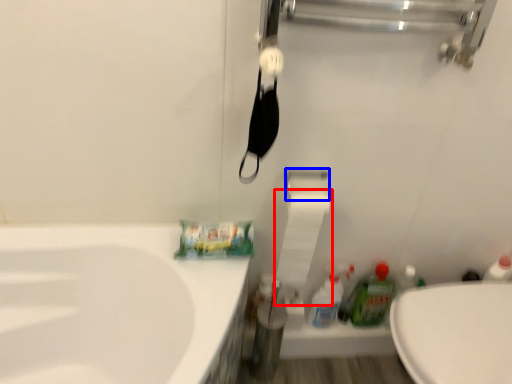
Question: Which object appears farthest to the camera in this image, toilet paper (highlighted by a red box) or towel bar (highlighted by a blue box)?

Choices:
 (A) toilet paper
 (B) towel bar

Answer: (B)